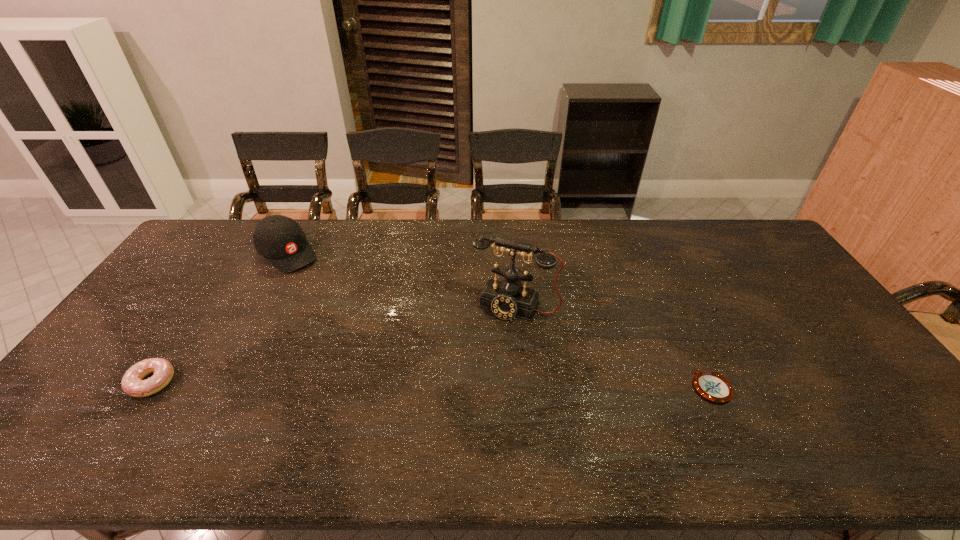
Find the location of a particular element. The height and width of the screenshot is (540, 960). object that is at the near left corner is located at coordinates (132, 383).

Locate an element on the screen. This screenshot has width=960, height=540. vacant position at the far edge of the desktop is located at coordinates (572, 252).

Image resolution: width=960 pixels, height=540 pixels. What are the coordinates of `vacant space at the near edge of the desktop` in the screenshot? It's located at (144, 417).

Find the location of a particular element. The height and width of the screenshot is (540, 960). vacant space at the left edge of the desktop is located at coordinates (130, 323).

At what (x,y) coordinates should I click in order to perform the action: click on vacant region at the right edge of the desktop. Please return your answer as a coordinate pair (x, y). The width and height of the screenshot is (960, 540). Looking at the image, I should click on (781, 285).

At what (x,y) coordinates should I click in order to perform the action: click on vacant area that lies between the second object from left to right and the third object from left to right. Please return your answer as a coordinate pair (x, y). Looking at the image, I should click on (401, 280).

Where is `free spot between the farthest object and the telephone`? This screenshot has width=960, height=540. free spot between the farthest object and the telephone is located at coordinates (401, 280).

Identify the location of free area in between the leftmost object and the third object from left to right. (334, 344).

Where is `vacant point located between the third object from left to right and the farthest object`? The image size is (960, 540). vacant point located between the third object from left to right and the farthest object is located at coordinates (401, 280).

Where is `empty space that is in between the second farthest object and the shortest object`? The width and height of the screenshot is (960, 540). empty space that is in between the second farthest object and the shortest object is located at coordinates (613, 346).